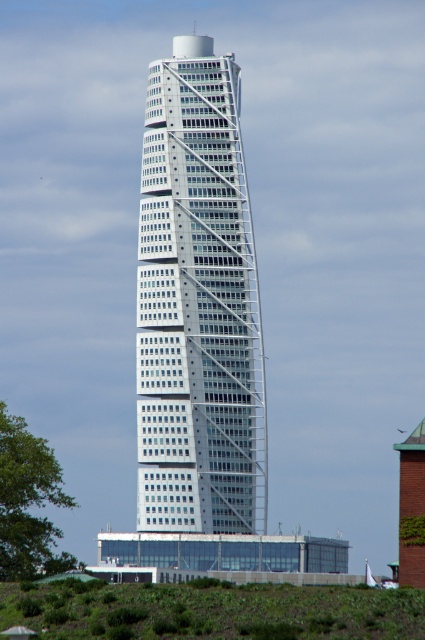
Question: Which point appears closest to the camera in this image?

Choices:
 (A) (274, 632)
 (B) (246, 490)

Answer: (A)

Question: Can you confirm if white glass building at center is positioned above green grass at lower left?

Choices:
 (A) yes
 (B) no

Answer: (A)

Question: Can you confirm if white glass building at center is thinner than green grass at lower left?

Choices:
 (A) no
 (B) yes

Answer: (B)

Question: Can you confirm if white glass building at center is positioned to the left of green grass at lower left?

Choices:
 (A) yes
 (B) no

Answer: (A)

Question: Which object appears closest to the camera in this image?

Choices:
 (A) green grass at lower left
 (B) white glass building at center

Answer: (A)